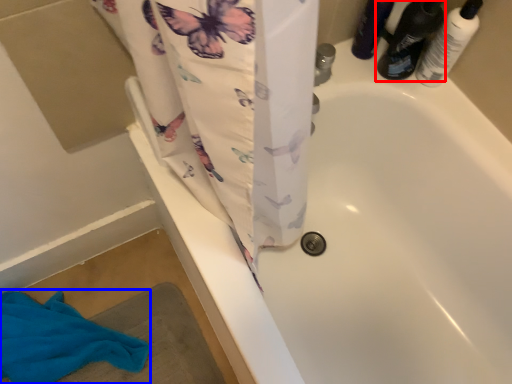
Question: Which point is closer to the camera, footwear (highlighted by a red box) or beach towel (highlighted by a blue box)?

Choices:
 (A) footwear
 (B) beach towel

Answer: (A)